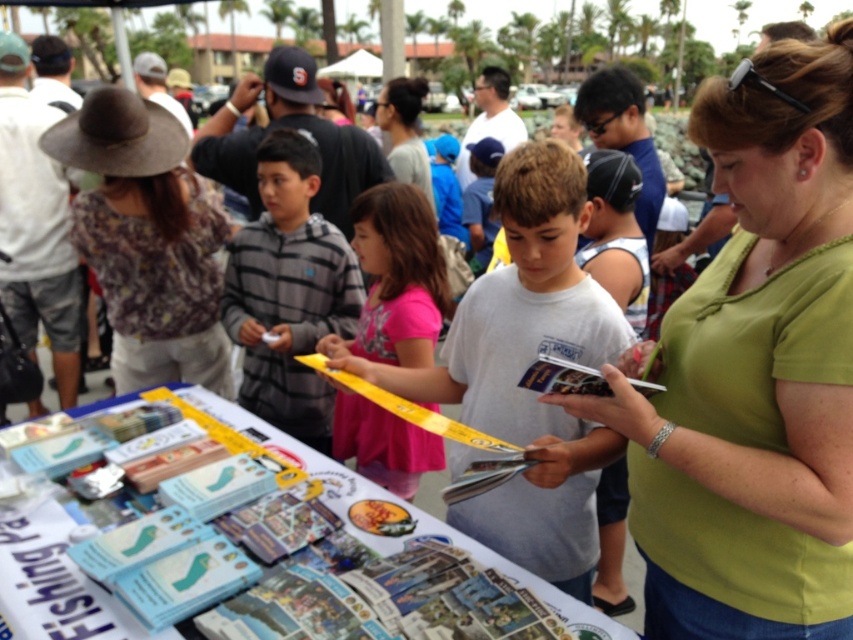
Which of these two, green matte shirt at center or white cotton shirt at center, stands shorter?

white cotton shirt at center is shorter.

Who is positioned more to the left, green matte shirt at center or white cotton shirt at center?

white cotton shirt at center

This screenshot has width=853, height=640. I want to click on green matte shirt at center, so click(x=753, y=372).

Does white cotton shirt at center have a greater height compared to brown woven hat at upper left?

No.

Does white cotton shirt at center appear over brown woven hat at upper left?

Incorrect, white cotton shirt at center is not positioned above brown woven hat at upper left.

Is point (495, 332) closer to viewer compared to point (138, 189)?

That is True.

This screenshot has height=640, width=853. Find the location of `white cotton shirt at center`. white cotton shirt at center is located at coordinates (526, 368).

Which is more to the left, white cotton shirt at center or gray striped sweater at center?

gray striped sweater at center is more to the left.

Is white cotton shirt at center in front of gray striped sweater at center?

Yes, it is.

What do you see at coordinates (526, 368) in the screenshot? The height and width of the screenshot is (640, 853). I see `white cotton shirt at center` at bounding box center [526, 368].

Locate an element on the screen. The image size is (853, 640). white cotton shirt at center is located at coordinates (526, 368).